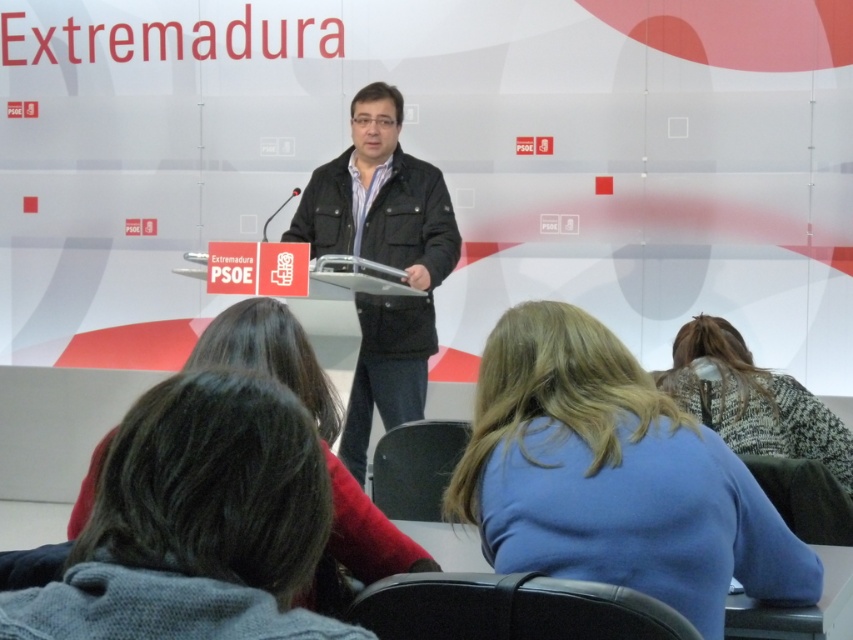
You are attending a political event and notice a specific point marked at coordinates (612, 476). Based on the scene, what object or feature is located at that point?

The point at coordinates (612, 476) is on the blue fabric shirt at center.

You are a photographer at the event and need to capture a closeup shot of both the blue fabric shirt at center and the patterned sweater at center. Your camera has a maximum focus range of 4 feet. Can you focus on both subjects simultaneously?

The distance between the blue fabric shirt at center and the patterned sweater at center is 4.25 feet. Since the camera can only focus within 4 feet, you cannot capture both subjects in focus at the same time.